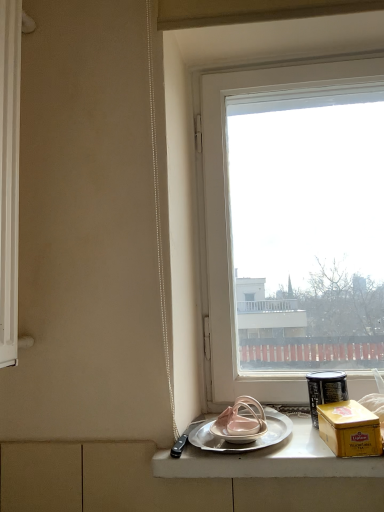
Question: Does silver metallic tray at lower center turn towards metallic silver canister at right?

Choices:
 (A) no
 (B) yes

Answer: (A)

Question: From a real-world perspective, is silver metallic tray at lower center over metallic silver canister at right?

Choices:
 (A) yes
 (B) no

Answer: (B)

Question: Is silver metallic tray at lower center further to camera compared to metallic silver canister at right?

Choices:
 (A) no
 (B) yes

Answer: (A)

Question: Does silver metallic tray at lower center have a greater width compared to metallic silver canister at right?

Choices:
 (A) no
 (B) yes

Answer: (B)

Question: Is the depth of silver metallic tray at lower center less than that of metallic silver canister at right?

Choices:
 (A) no
 (B) yes

Answer: (B)

Question: Is metallic silver canister at right surrounded by silver metallic tray at lower center?

Choices:
 (A) no
 (B) yes

Answer: (A)

Question: Considering the relative sizes of silver metallic plate at lower center and silver metallic tray at lower center in the image provided, is silver metallic plate at lower center thinner than silver metallic tray at lower center?

Choices:
 (A) yes
 (B) no

Answer: (A)

Question: Can you confirm if silver metallic plate at lower center is shorter than silver metallic tray at lower center?

Choices:
 (A) yes
 (B) no

Answer: (A)

Question: From a real-world perspective, is silver metallic plate at lower center located higher than silver metallic tray at lower center?

Choices:
 (A) yes
 (B) no

Answer: (A)

Question: Is the surface of silver metallic plate at lower center in direct contact with silver metallic tray at lower center?

Choices:
 (A) no
 (B) yes

Answer: (B)

Question: Is silver metallic plate at lower center behind silver metallic tray at lower center?

Choices:
 (A) no
 (B) yes

Answer: (B)

Question: Can you confirm if silver metallic plate at lower center is taller than silver metallic tray at lower center?

Choices:
 (A) no
 (B) yes

Answer: (A)

Question: Is metallic silver canister at right positioned behind transparent glass window at center?

Choices:
 (A) yes
 (B) no

Answer: (B)